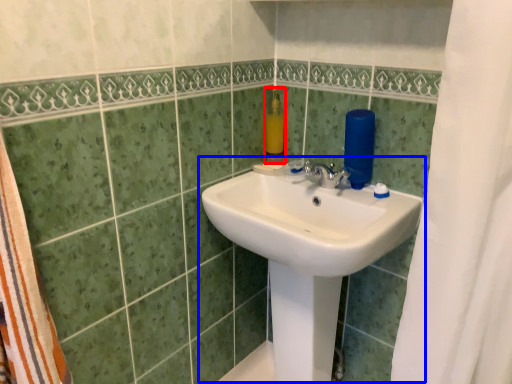
Question: Which point is closer to the camera, soap dispenser (highlighted by a red box) or sink (highlighted by a blue box)?

Choices:
 (A) soap dispenser
 (B) sink

Answer: (B)